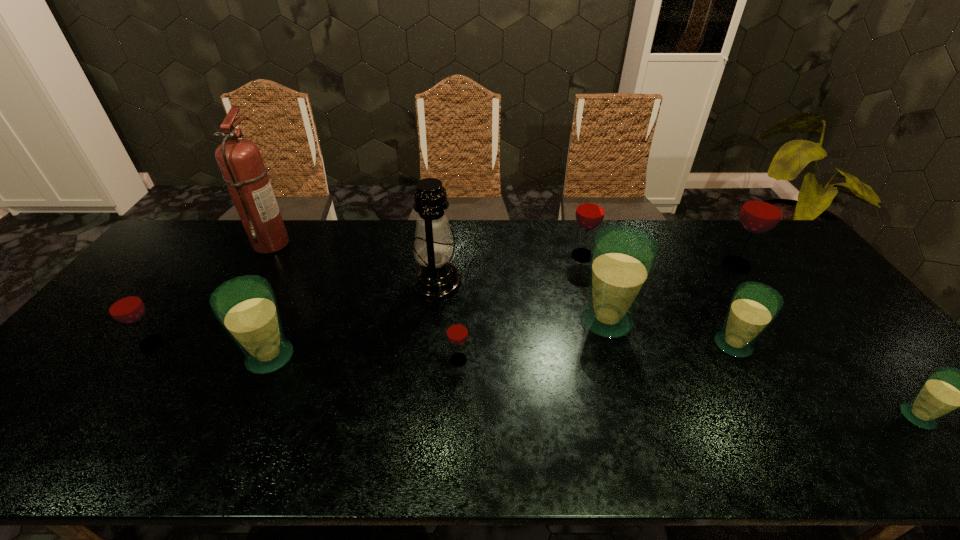
Find the location of a particular element. The image size is (960, 540). object that is positioned at the left edge is located at coordinates [123, 304].

Where is `object present at the right edge`? The width and height of the screenshot is (960, 540). object present at the right edge is located at coordinates (946, 389).

This screenshot has height=540, width=960. Find the location of `object present at the near right corner`. object present at the near right corner is located at coordinates (946, 389).

The width and height of the screenshot is (960, 540). In order to click on vacant region at the far edge of the desktop in this screenshot , I will do `click(636, 222)`.

Locate an element on the screen. free space at the near edge of the desktop is located at coordinates (588, 444).

You are a GUI agent. You are given a task and a screenshot of the screen. Output one action in this format:
    pyautogui.click(x=<x>, y=<y>)
    Task: Click on the free location at the left edge
    
    Given the screenshot: What is the action you would take?
    pyautogui.click(x=80, y=347)

This screenshot has width=960, height=540. What are the coordinates of `vacant point at the far left corner` in the screenshot? It's located at (190, 260).

Identify the location of vacant space at the near left corner of the desktop. The image size is (960, 540). (15, 433).

Find the location of a particular element. The height and width of the screenshot is (540, 960). unoccupied area between the second tallest object and the leftmost glass is located at coordinates (295, 313).

Locate an element on the screen. empty space that is in between the second glass from right to left and the ninth object from right to left is located at coordinates (504, 254).